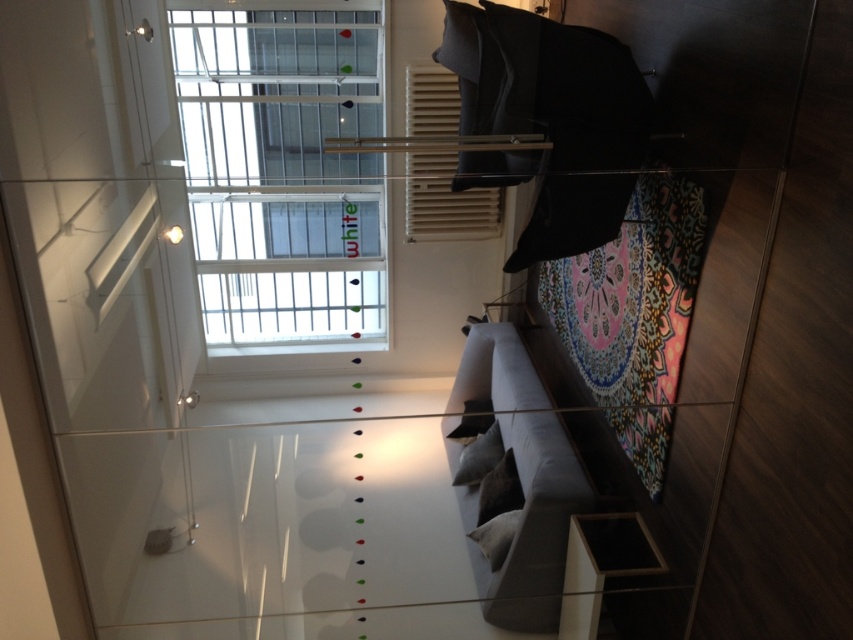
Question: Can you confirm if velvet gray pillow at center is positioned to the left of suede pillow at lower center?

Choices:
 (A) yes
 (B) no

Answer: (B)

Question: Which point is closer to the camera?

Choices:
 (A) transparent glass window at upper center
 (B) velvet gray pillow at center
 (C) suede pillow at lower center
 (D) suede-like gray pillow at center

Answer: (C)

Question: Can you confirm if suede-like gray pillow at center is thinner than suede pillow at lower center?

Choices:
 (A) yes
 (B) no

Answer: (B)

Question: Is velvet gray pillow at center to the left of suede pillow at lower center from the viewer's perspective?

Choices:
 (A) yes
 (B) no

Answer: (B)

Question: Which object is positioned closest to the suede-like gray pillow at center?

Choices:
 (A) dark gray fabric pillow at center
 (B) suede pillow at lower center
 (C) transparent glass window at upper center
 (D) velvet gray pillow at center

Answer: (A)

Question: Estimate the real-world distances between objects in this image. Which object is closer to the transparent glass window at upper center?

Choices:
 (A) dark gray fabric pillow at center
 (B) velvet gray pillow at center
 (C) suede-like gray pillow at center
 (D) suede pillow at lower center

Answer: (A)